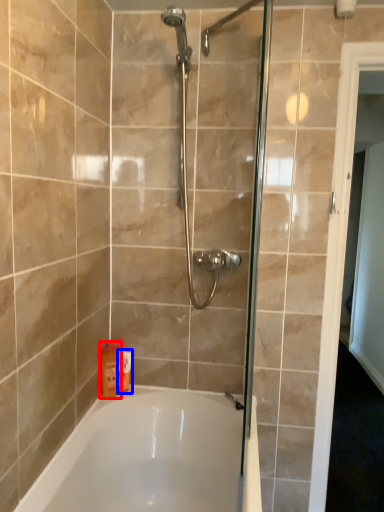
Question: Among these objects, which one is farthest to the camera, toiletry (highlighted by a red box) or toiletry (highlighted by a blue box)?

Choices:
 (A) toiletry
 (B) toiletry

Answer: (B)